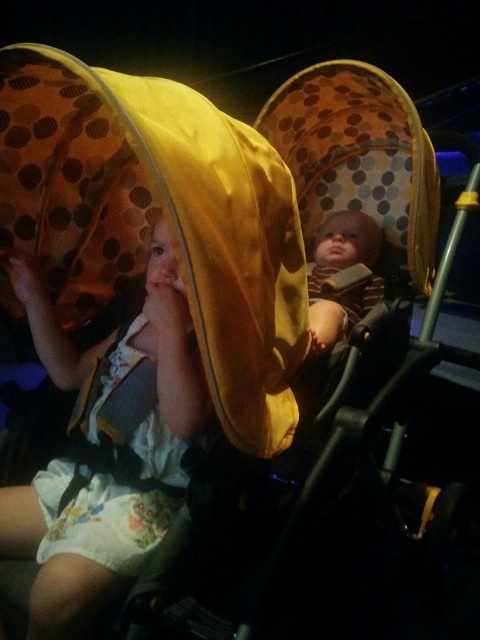
Describe the element at coordinates (167, 218) in the screenshot. The width and height of the screenshot is (480, 640). I see `yellow fabric blanket at upper left` at that location.

Who is higher up, yellow fabric blanket at upper left or matte yellow hood at upper left?

yellow fabric blanket at upper left

Which is behind, point (54, 147) or point (54, 326)?

The point (54, 326) is more distant.

Find the location of a particular element. yellow fabric blanket at upper left is located at coordinates pyautogui.click(x=167, y=218).

Is yellow fabric blanket at upper left bigger than striped knit sweater at center?

Indeed, yellow fabric blanket at upper left has a larger size compared to striped knit sweater at center.

Is point (74, 134) positioned after point (372, 296)?

No, (74, 134) is closer to viewer.

Does point (86, 253) lie behind point (335, 308)?

Yes.

This screenshot has height=640, width=480. Find the location of `yellow fabric blanket at upper left`. yellow fabric blanket at upper left is located at coordinates (167, 218).

Is matte yellow hood at upper left shorter than striped knit sweater at center?

No, matte yellow hood at upper left is not shorter than striped knit sweater at center.

Who is positioned more to the right, matte yellow hood at upper left or striped knit sweater at center?

striped knit sweater at center is more to the right.

The width and height of the screenshot is (480, 640). Describe the element at coordinates (131, 358) in the screenshot. I see `matte yellow hood at upper left` at that location.

At what (x,y) coordinates should I click in order to perform the action: click on matte yellow hood at upper left. Please return your answer as a coordinate pair (x, y). The height and width of the screenshot is (640, 480). Looking at the image, I should click on (131, 358).